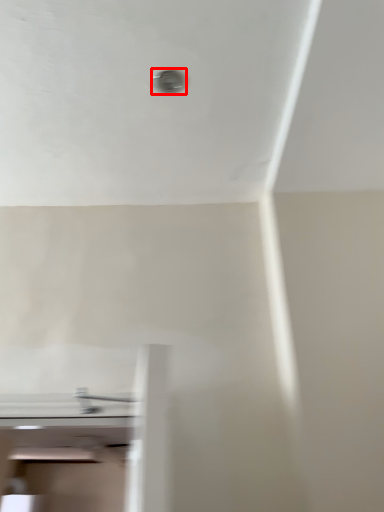
Question: From the image's perspective, what is the correct spatial relationship of hole (annotated by the red box) in relation to tap?

Choices:
 (A) below
 (B) above

Answer: (B)